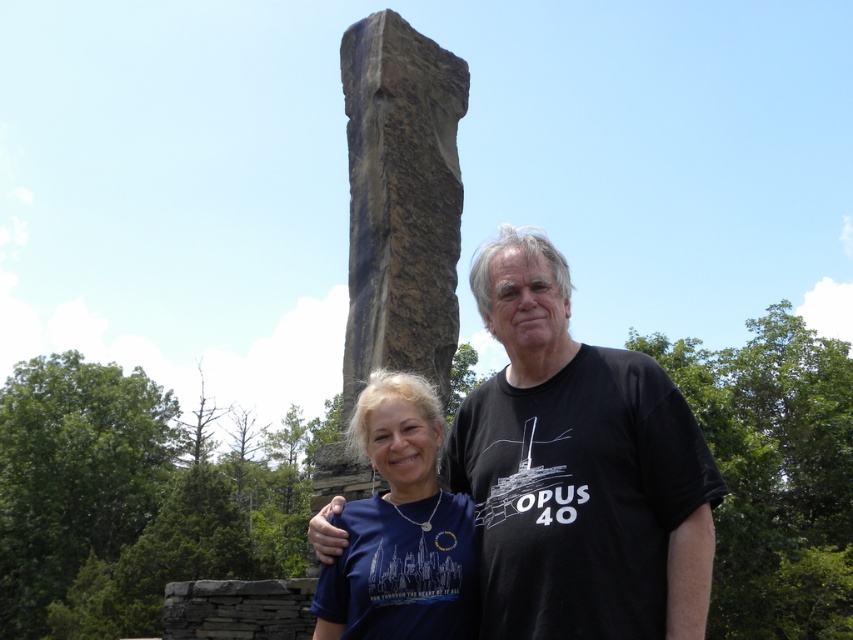
Question: Considering the relative positions of black cotton t-shirt at center and matte blue t-shirt at center in the image provided, where is black cotton t-shirt at center located with respect to matte blue t-shirt at center?

Choices:
 (A) above
 (B) below

Answer: (A)

Question: Which of the following is the closest to the observer?

Choices:
 (A) black cotton t-shirt at center
 (B) matte blue t-shirt at center

Answer: (A)

Question: Is black cotton t-shirt at center in front of matte blue t-shirt at center?

Choices:
 (A) no
 (B) yes

Answer: (B)

Question: Which point appears closest to the camera in this image?

Choices:
 (A) (355, 518)
 (B) (419, 67)

Answer: (A)

Question: Is black cotton t-shirt at center positioned before dark brown stone column at center?

Choices:
 (A) yes
 (B) no

Answer: (A)

Question: Which of the following is the farthest from the observer?

Choices:
 (A) black cotton t-shirt at center
 (B) dark brown stone column at center
 (C) matte blue t-shirt at center

Answer: (B)